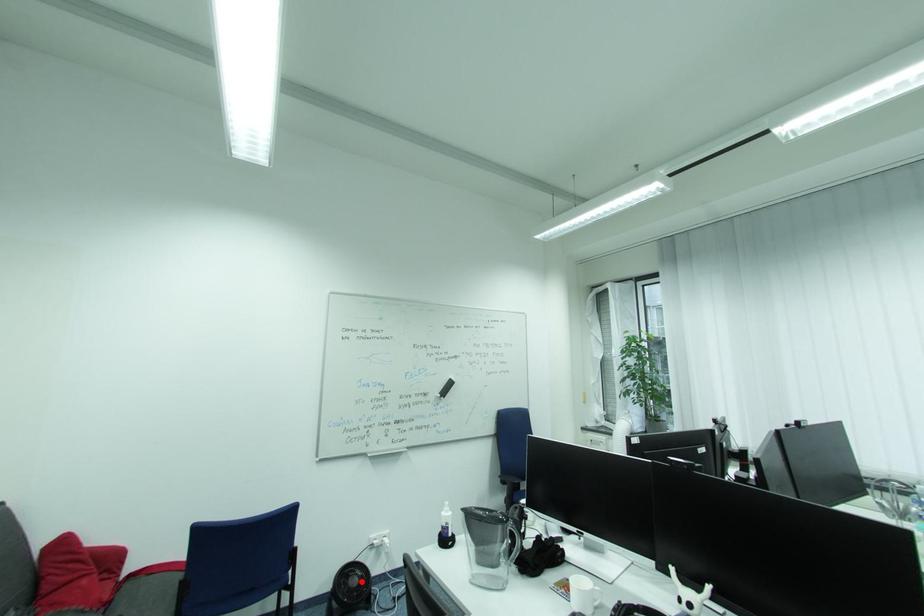
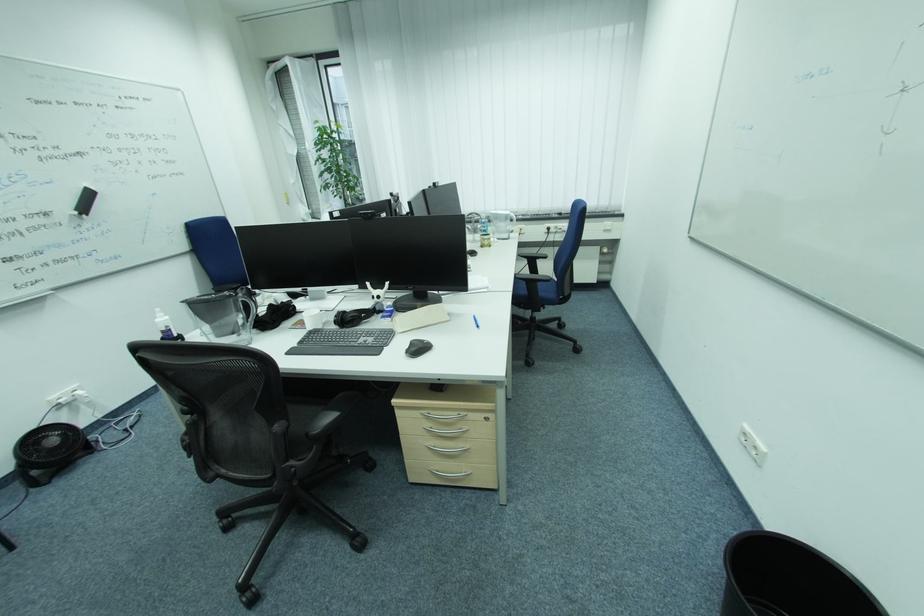
Locate, in the second image, the point that corresponds to the highlighted location in the first image.

(59, 442)